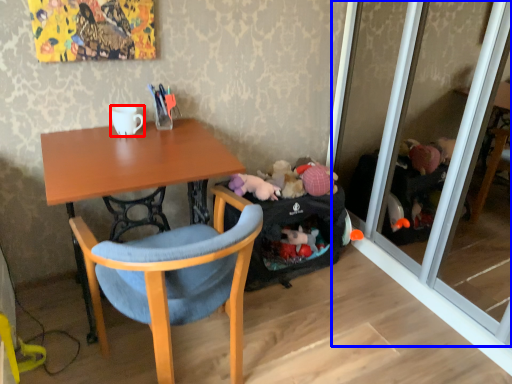
Question: Which object appears farthest to the camera in this image, coffee cup (highlighted by a red box) or screen door (highlighted by a blue box)?

Choices:
 (A) coffee cup
 (B) screen door

Answer: (A)